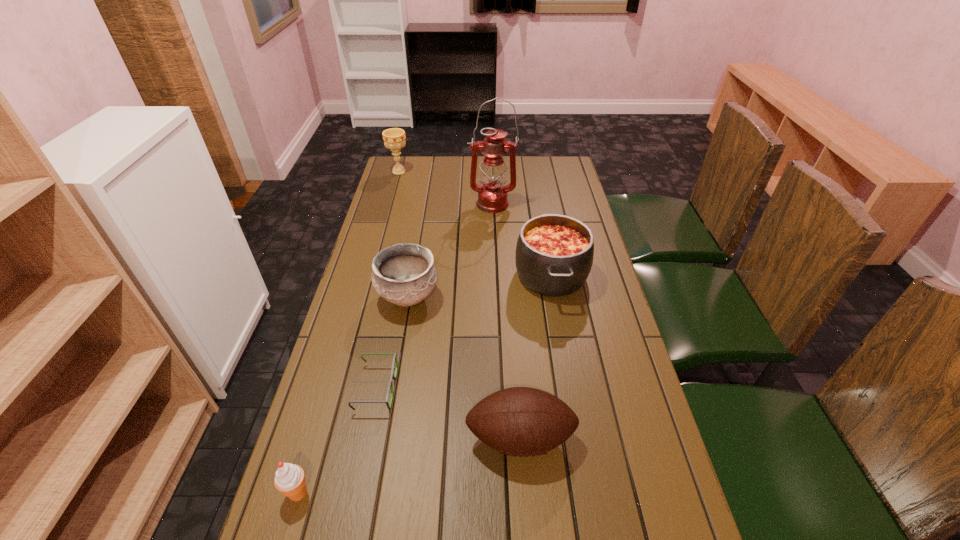
The height and width of the screenshot is (540, 960). Find the location of `object at the right edge`. object at the right edge is located at coordinates (554, 253).

The image size is (960, 540). Find the location of `object that is positioned at the far left corner`. object that is positioned at the far left corner is located at coordinates (394, 138).

Locate an element on the screen. The height and width of the screenshot is (540, 960). vacant space at the far edge of the desktop is located at coordinates (531, 159).

In the image, there is a desktop. Identify the location of free region at the left edge. This screenshot has width=960, height=540. (349, 358).

This screenshot has height=540, width=960. In the image, there is a desktop. In order to click on free space at the right edge in this screenshot , I will do `click(540, 193)`.

The height and width of the screenshot is (540, 960). Find the location of `vacant space at the far right corner of the desktop`. vacant space at the far right corner of the desktop is located at coordinates (567, 159).

Find the location of a particular element. free space that is in between the spectacles and the casserole is located at coordinates (464, 332).

Identify the location of vacant space that is in between the shortest object and the tallest object. (434, 296).

Image resolution: width=960 pixels, height=540 pixels. What are the coordinates of `empty space that is in between the shortest object and the casserole` in the screenshot? It's located at (464, 332).

Identify the location of blank region between the chalice and the pottery. The image size is (960, 540). (403, 234).